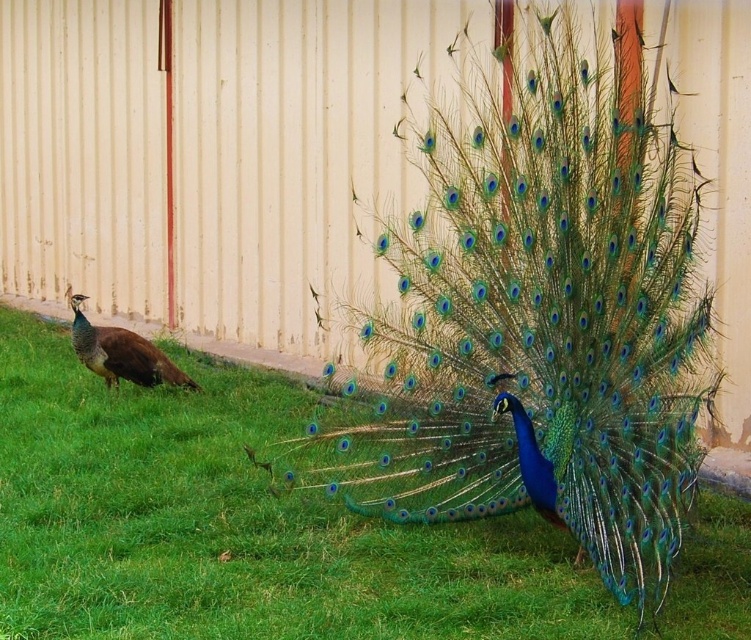
Question: Can you confirm if green grass at lower left is wider than matte brown peacock at left?

Choices:
 (A) yes
 (B) no

Answer: (A)

Question: Does green grass at lower left have a greater width compared to matte brown peacock at left?

Choices:
 (A) no
 (B) yes

Answer: (B)

Question: Among these objects, which one is farthest from the camera?

Choices:
 (A) matte brown peacock at left
 (B) green grass at lower left

Answer: (A)

Question: Which point appears closest to the camera in this image?

Choices:
 (A) (553, 445)
 (B) (170, 372)
 (C) (225, 588)

Answer: (A)

Question: Among these points, which one is nearest to the camera?

Choices:
 (A) (575, 278)
 (B) (92, 339)
 (C) (237, 451)

Answer: (A)

Question: Does shiny blue peacock at center appear on the left side of matte brown peacock at left?

Choices:
 (A) no
 (B) yes

Answer: (A)